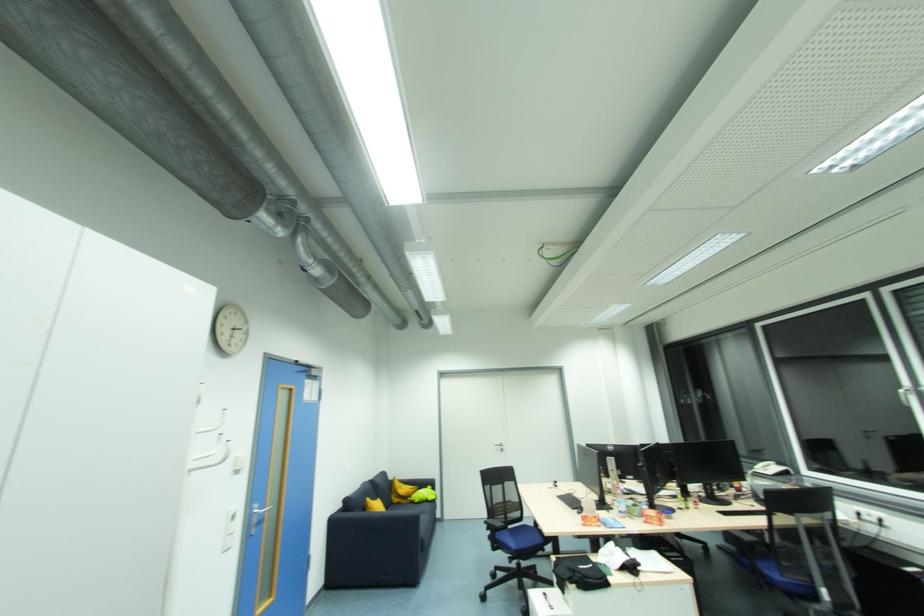
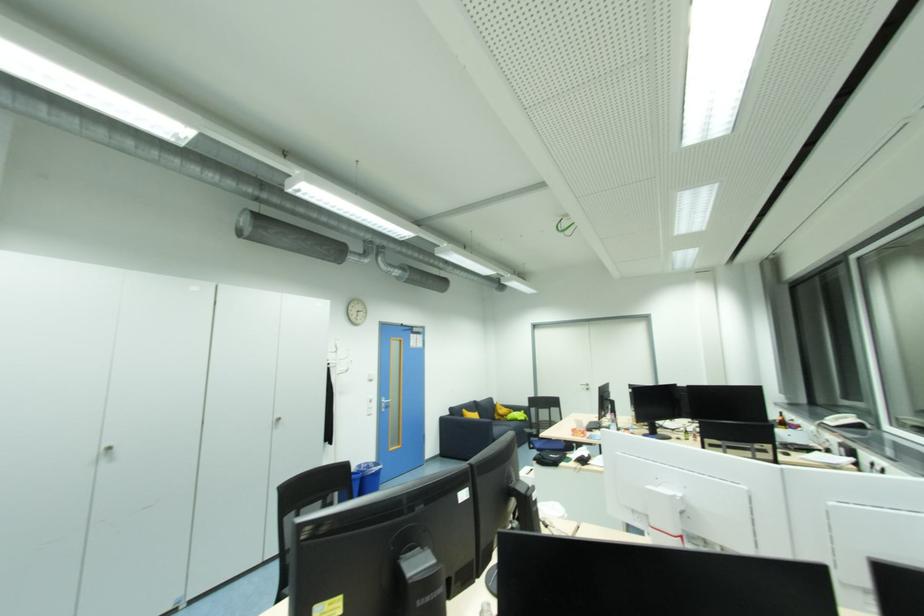
In the second image, find the point that corresponds to (772,467) in the first image.

(850, 419)